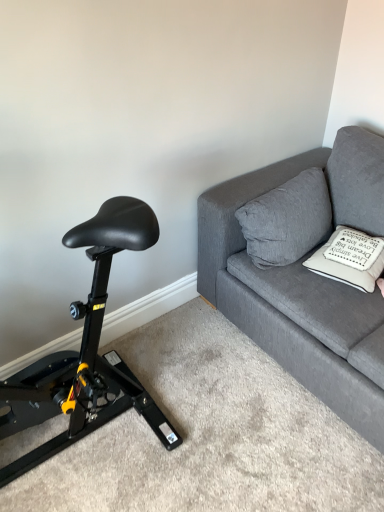
Question: In the image, is black leather saddle at left positioned in front of or behind textured gray couch at upper right?

Choices:
 (A) front
 (B) behind

Answer: (A)

Question: Considering the positions of point (48, 444) and point (246, 296), is point (48, 444) closer or farther from the camera than point (246, 296)?

Choices:
 (A) farther
 (B) closer

Answer: (B)

Question: Which object is positioned farthest from the black leather saddle at left?

Choices:
 (A) white soft cushion at upper right, which is counted as the second pillow, starting from the left
 (B) gray fabric pillow at upper right, which is the first pillow from left to right
 (C) textured gray couch at upper right

Answer: (A)

Question: Estimate the real-world distances between objects in this image. Which object is farther from the white soft cushion at upper right, marked as the first pillow in a right-to-left arrangement?

Choices:
 (A) black leather saddle at left
 (B) gray fabric pillow at upper right, which is the first pillow from left to right
 (C) textured gray couch at upper right

Answer: (A)